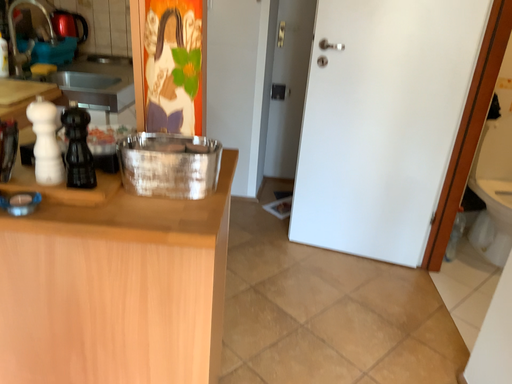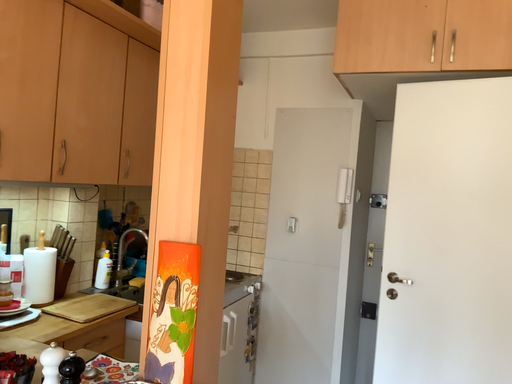
Question: How did the camera likely rotate when shooting the video?

Choices:
 (A) rotated upward
 (B) rotated downward

Answer: (A)